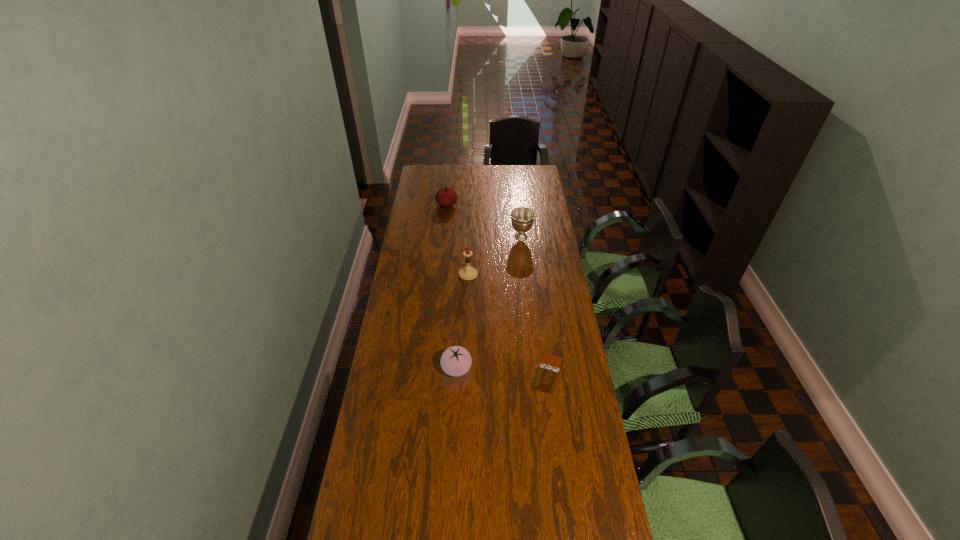
You are a GUI agent. You are given a task and a screenshot of the screen. Output one action in this format:
    pyautogui.click(x=<x>, y=<y>)
    Task: Click on the third farthest object
    This screenshot has width=960, height=540.
    Given the screenshot: What is the action you would take?
    pyautogui.click(x=466, y=273)

This screenshot has height=540, width=960. Identify the location of chalice. (522, 218).

This screenshot has height=540, width=960. I want to click on the fourth nearest object, so click(522, 218).

The height and width of the screenshot is (540, 960). I want to click on the farthest object, so click(446, 197).

Image resolution: width=960 pixels, height=540 pixels. What are the coordinates of `the nearer tomato` in the screenshot? It's located at (455, 361).

At what (x,y) coordinates should I click in order to perform the action: click on chocolate bar. Please return your answer as a coordinate pair (x, y). Looking at the image, I should click on point(548,370).

The image size is (960, 540). What are the coordinates of `free space located on the back of the third farthest object` in the screenshot? It's located at (469, 247).

Find the location of a particular element. free space located on the left of the chalice is located at coordinates (440, 237).

This screenshot has width=960, height=540. I want to click on vacant space located on the left of the farther tomato, so 418,205.

Where is `vacant area situated on the front of the nearer tomato`? The height and width of the screenshot is (540, 960). vacant area situated on the front of the nearer tomato is located at coordinates (453, 444).